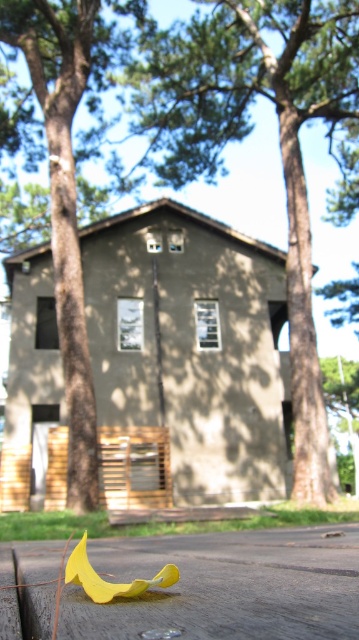
Image resolution: width=359 pixels, height=640 pixels. What do you see at coordinates (246, 132) in the screenshot?
I see `brown textured wood at center` at bounding box center [246, 132].

Identify the location of brown textured wood at center. [246, 132].